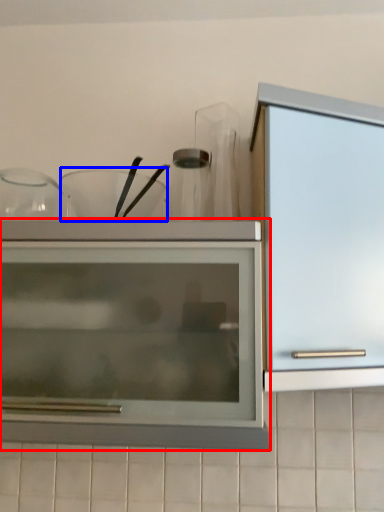
Question: Which object is further to the camera taking this photo, cupboard (highlighted by a red box) or tableware (highlighted by a blue box)?

Choices:
 (A) cupboard
 (B) tableware

Answer: (B)